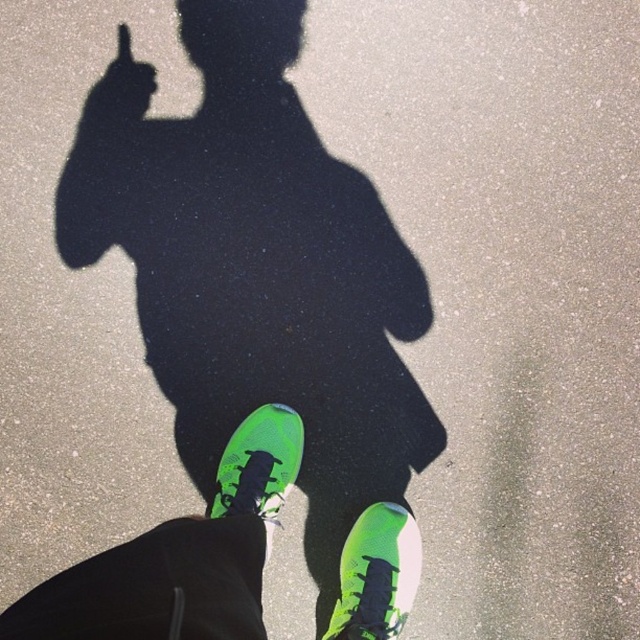
Question: Is neon green synthetic shoe at lower center smaller than neon green rubber shoe at center?

Choices:
 (A) yes
 (B) no

Answer: (A)

Question: Which is farther from the neon green sneakers at center?

Choices:
 (A) neon green rubber shoe at center
 (B) neon green synthetic shoe at lower center
 (C) green matte hand at upper left

Answer: (C)

Question: Which object is positioned closest to the neon green rubber shoe at center?

Choices:
 (A) neon green sneakers at center
 (B) green matte hand at upper left

Answer: (A)

Question: Which point is closer to the camera?

Choices:
 (A) neon green synthetic shoe at lower center
 (B) neon green sneakers at center

Answer: (A)

Question: Is neon green synthetic shoe at lower center to the right of neon green rubber shoe at center from the viewer's perspective?

Choices:
 (A) yes
 (B) no

Answer: (A)

Question: Does neon green sneakers at center lie behind green matte hand at upper left?

Choices:
 (A) yes
 (B) no

Answer: (B)